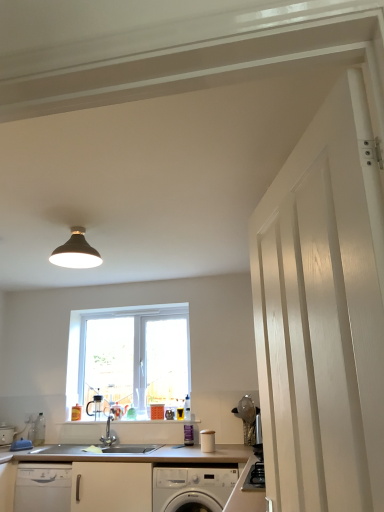
Where is `blank space situated above matte black light fixture at upper center (from a real-world perspective)`? This screenshot has width=384, height=512. blank space situated above matte black light fixture at upper center (from a real-world perspective) is located at coordinates (x=80, y=227).